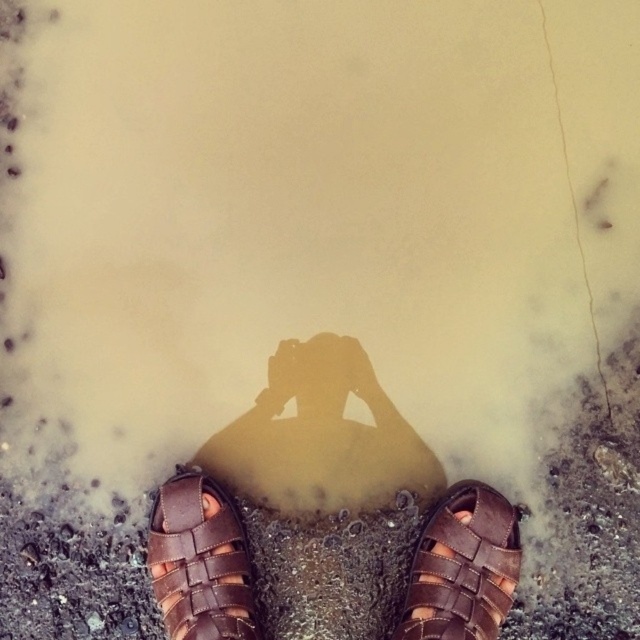
Can you confirm if brown leather sandals at lower center is thinner than brown leather sandal at lower center?

In fact, brown leather sandals at lower center might be wider than brown leather sandal at lower center.

Is brown leather sandals at lower center below brown leather sandal at lower center?

No.

Is point (192, 472) farther from camera compared to point (417, 596)?

Yes, point (192, 472) is farther from viewer.

I want to click on brown leather sandals at lower center, so click(x=275, y=480).

Can you confirm if brown leather sandal at lower left is bigger than brown leather sandal at lower center?

Yes.

Image resolution: width=640 pixels, height=640 pixels. Describe the element at coordinates (198, 561) in the screenshot. I see `brown leather sandal at lower left` at that location.

The image size is (640, 640). Find the location of `brown leather sandal at lower left`. brown leather sandal at lower left is located at coordinates (198, 561).

Is brown leather sandals at lower center positioned in front of brown leather sandal at lower left?

No.

Which is behind, point (362, 358) or point (156, 528)?

The point (362, 358) is behind.

Who is more forward, (163, 516) or (230, 579)?

Positioned in front is point (230, 579).

At what (x,y) coordinates should I click in order to perform the action: click on brown leather sandals at lower center. Please return your answer as a coordinate pair (x, y). Looking at the image, I should click on (275, 480).